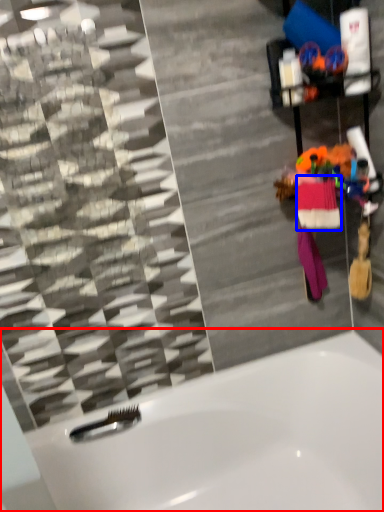
Question: Among these objects, which one is farthest to the camera, bathtub (highlighted by a red box) or clothing (highlighted by a blue box)?

Choices:
 (A) bathtub
 (B) clothing

Answer: (B)